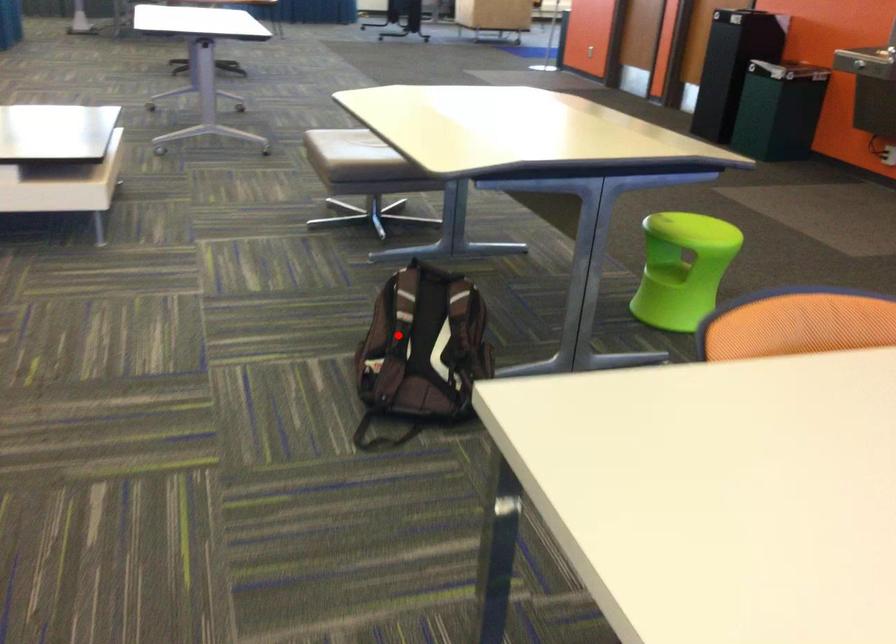
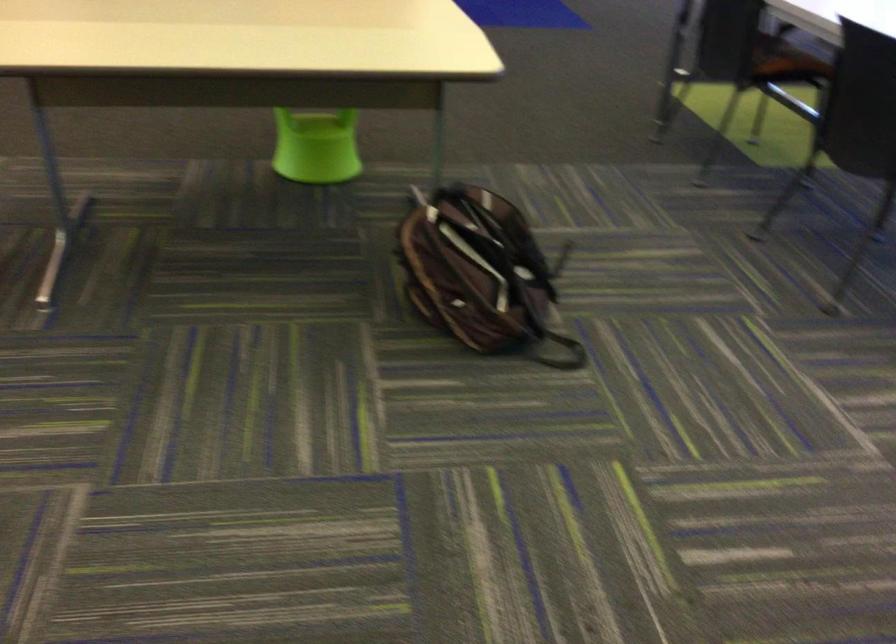
Question: I am providing you with two images of the same scene from different viewpoints. A red point is marked on the first image. Can you still see the location of the red point in image 2?

Choices:
 (A) Yes
 (B) No

Answer: (A)